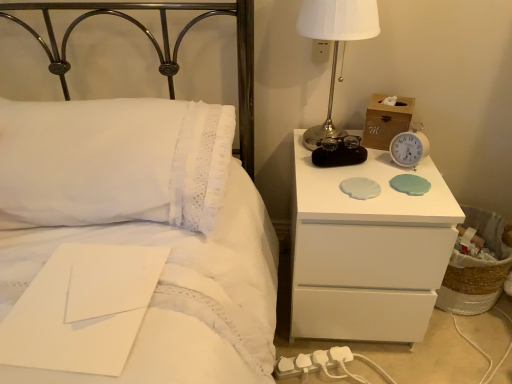
Where is `vacant area that is in front of silver metallic bedside lamp at upper right`? The width and height of the screenshot is (512, 384). vacant area that is in front of silver metallic bedside lamp at upper right is located at coordinates (337, 181).